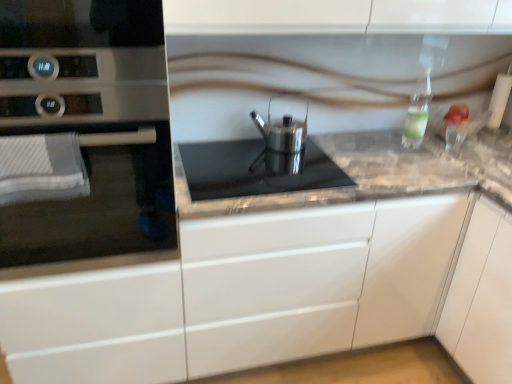
What are the coordinates of `blank space to the left of clear glass bottle at upper right` in the screenshot? It's located at (380, 150).